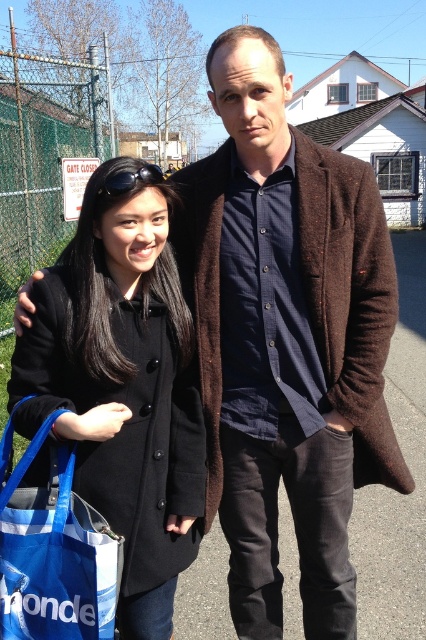
Consider the image. Does black wool coat at left appear under blue fabric bag at lower left?

No.

Is point (155, 289) positioned in front of point (74, 538)?

That is False.

Where is `black wool coat at left`? This screenshot has width=426, height=640. black wool coat at left is located at coordinates (123, 388).